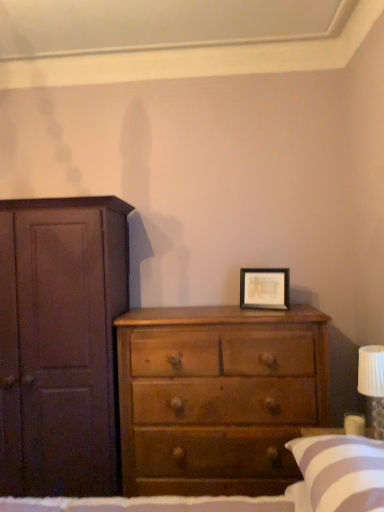
Question: Choose the correct answer: Is light brown wood chest of drawers at center inside white striped pillow at lower right or outside it?

Choices:
 (A) outside
 (B) inside

Answer: (A)

Question: In terms of height, does light brown wood chest of drawers at center look taller or shorter compared to white striped pillow at lower right?

Choices:
 (A) tall
 (B) short

Answer: (A)

Question: Which object is positioned farthest from the white pleated fabric at right?

Choices:
 (A) matte dark brown cupboard at left
 (B) wooden framed artwork at center right
 (C) light brown wood chest of drawers at center
 (D) white striped pillow at lower right

Answer: (A)

Question: Which object is the closest to the light brown wood chest of drawers at center?

Choices:
 (A) wooden framed artwork at center right
 (B) white striped pillow at lower right
 (C) matte dark brown cupboard at left
 (D) white pleated fabric at right

Answer: (C)